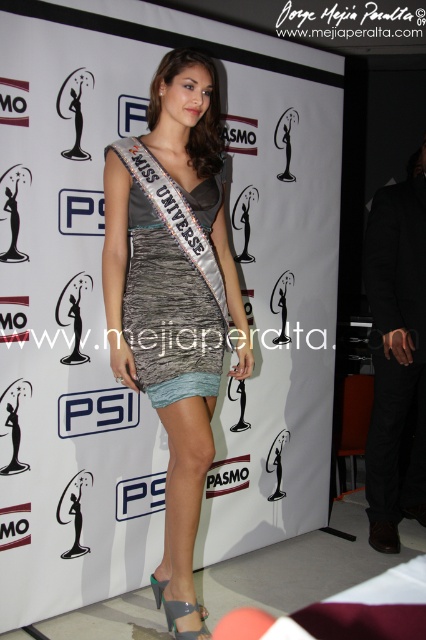
You are a photographer at the Miss Universe event. You need to capture a clear photo of the shiny metallic dress at center without the satin dress at center blocking it. How should you adjust your camera angle?

The shiny metallic dress at center is behind the satin dress at center. To capture a clear photo of the shiny metallic dress at center without obstruction, you should adjust your camera angle to position the camera behind the satin dress at center so that the shiny metallic dress at center becomes visible.

What are the coordinates of the satin dress at center in the image?

The satin dress at center is located at point (173, 285).